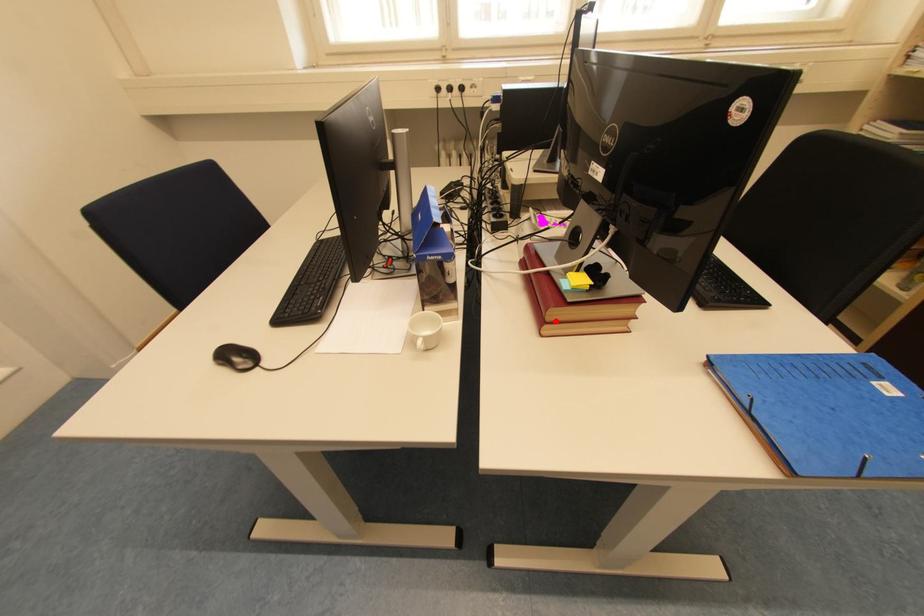
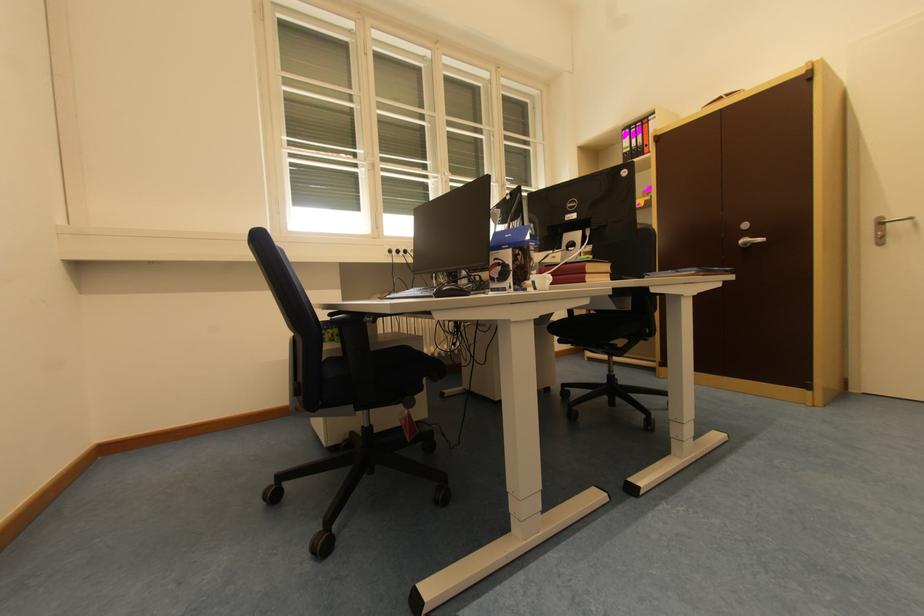
Locate, in the second image, the point that corresponds to the highlighted location in the first image.

(593, 273)